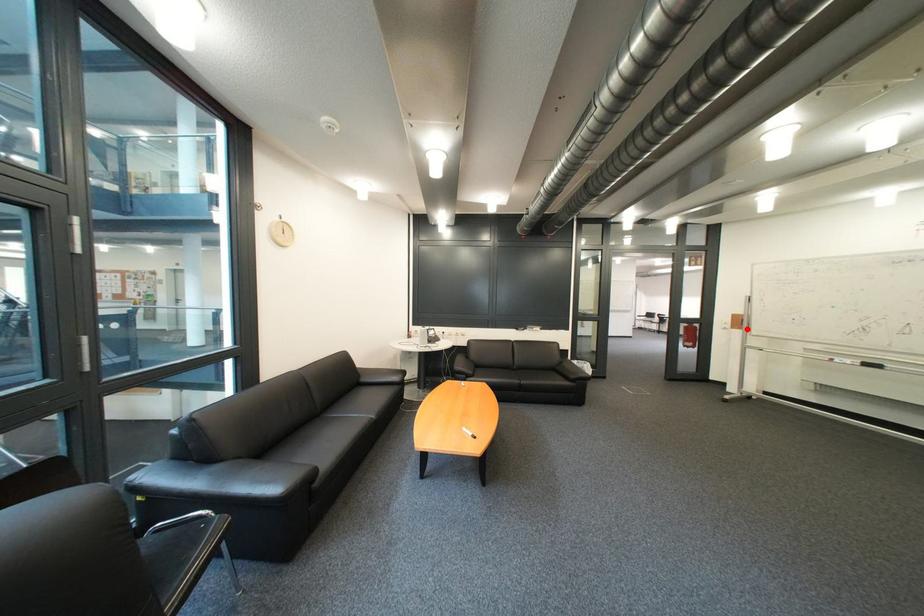
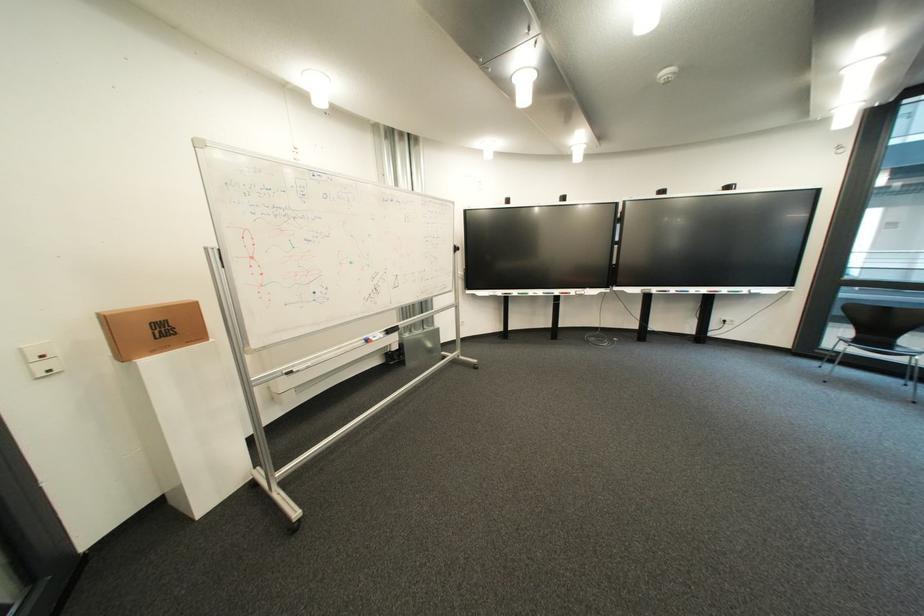
In the second image, find the point that corresponds to the highlighted location in the first image.

(139, 358)